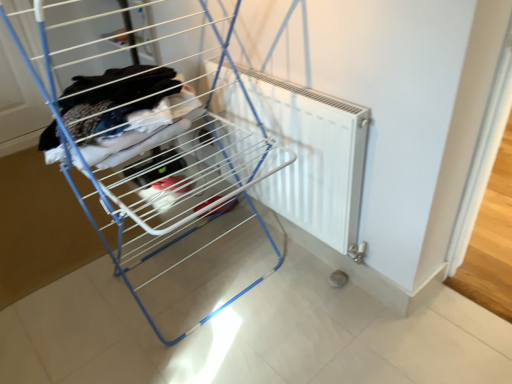
Locate an element on the screen. free spot below white plastic radiator at center (from a real-world perspective) is located at coordinates (201, 270).